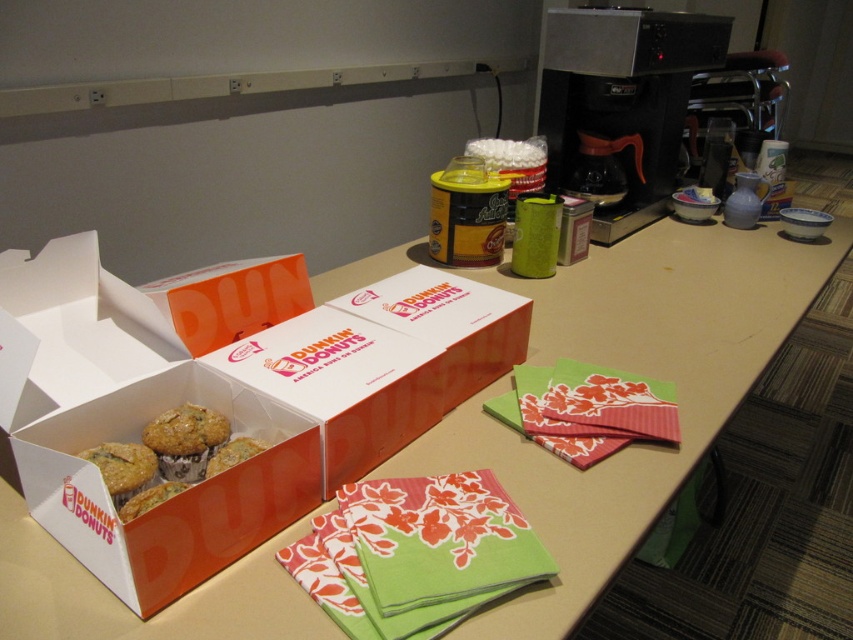
Can you confirm if orange cardboard box at center is positioned to the right of golden-brown muffin at center?

Yes, orange cardboard box at center is to the right of golden-brown muffin at center.

From the picture: Who is higher up, orange cardboard box at center or golden-brown muffin at center?

orange cardboard box at center is higher up.

Who is more distant from viewer, (583, 340) or (119, 476)?

The point (583, 340) is more distant.

You are a GUI agent. You are given a task and a screenshot of the screen. Output one action in this format:
    pyautogui.click(x=<x>, y=<y>)
    Task: Click on the orange cardboard box at center
    This screenshot has width=853, height=640.
    Given the screenshot: What is the action you would take?
    pyautogui.click(x=634, y=371)

Is orange cardboard box at center bigger than golden-brown muffin at lower left?

Indeed, orange cardboard box at center has a larger size compared to golden-brown muffin at lower left.

Which is more to the left, orange cardboard box at center or golden-brown muffin at lower left?

golden-brown muffin at lower left is more to the left.

Between point (711, 248) and point (171, 454), which one is positioned in front?

Point (171, 454)

Locate an element on the screen. Image resolution: width=853 pixels, height=640 pixels. orange cardboard box at center is located at coordinates tap(634, 371).

Who is more distant from viewer, (698, 234) or (445, 301)?

The point (698, 234) is more distant.

What do you see at coordinates (634, 371) in the screenshot? The height and width of the screenshot is (640, 853). I see `orange cardboard box at center` at bounding box center [634, 371].

Where is `orange cardboard box at center`? orange cardboard box at center is located at coordinates (634, 371).